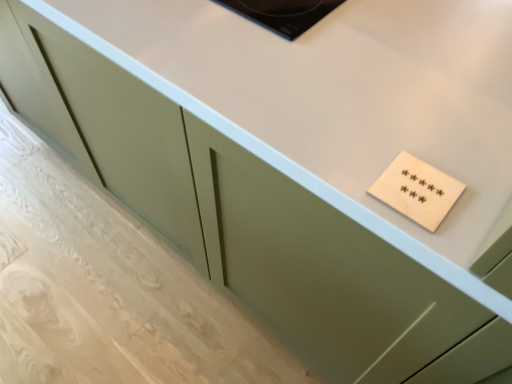
Identify the location of vacant space to the right of wooden plaque at upper right. (482, 180).